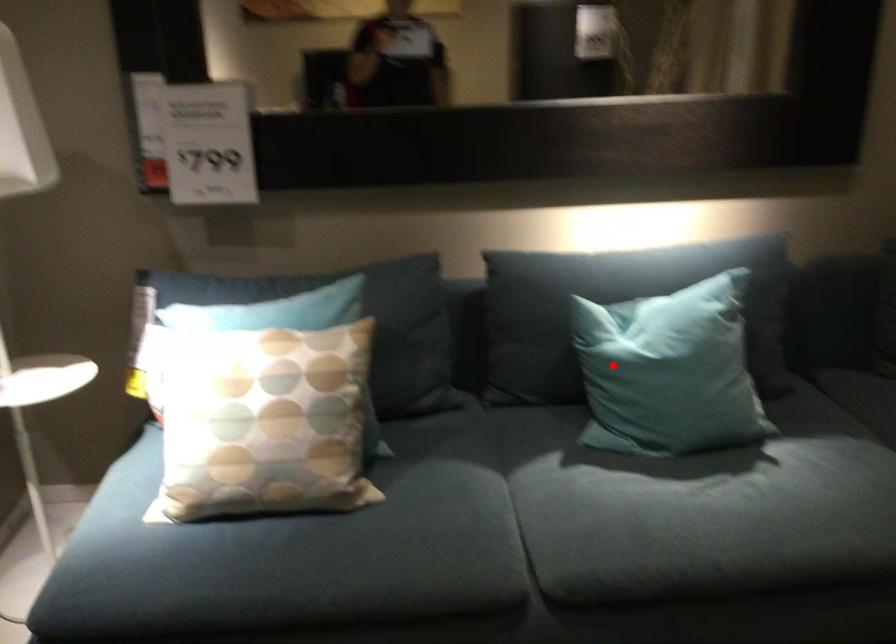
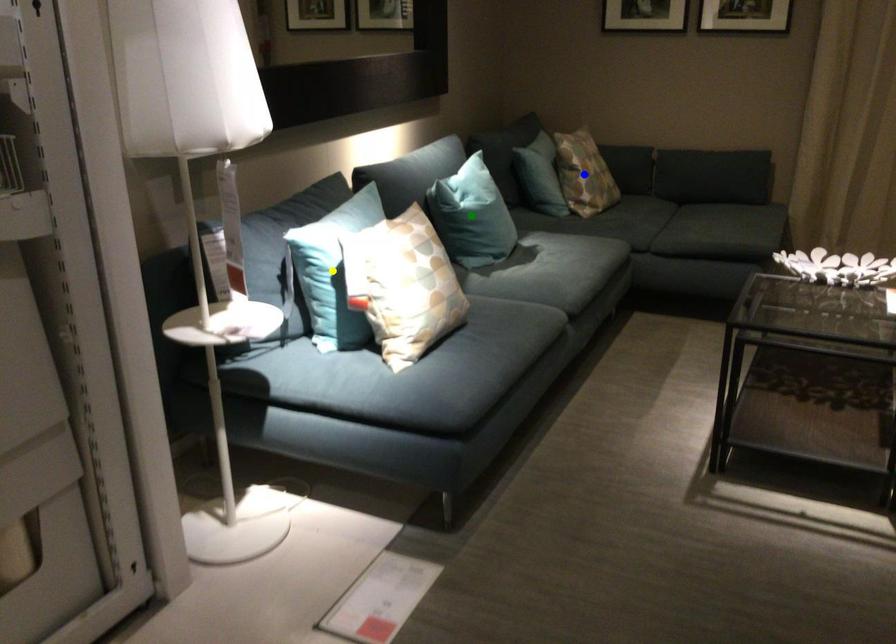
Question: I am providing you with two images of the same scene from different viewpoints. A red point is marked on the first image. You are given multiple points on the second image. Which spot in image 2 lines up with the point in image 1?

Choices:
 (A) blue point
 (B) green point
 (C) yellow point

Answer: (B)